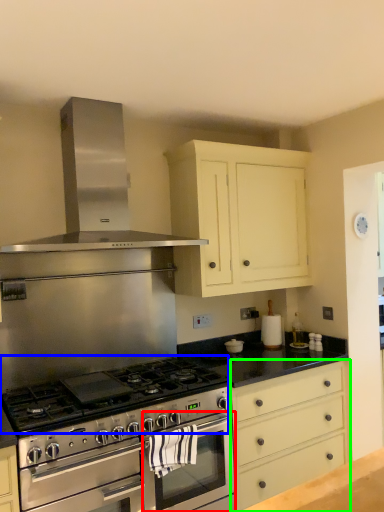
Question: Estimate the real-world distances between objects in this image. Which object is closer to oven (highlighted by a red box), gas stove (highlighted by a blue box) or drawer (highlighted by a green box)?

Choices:
 (A) gas stove
 (B) drawer

Answer: (A)